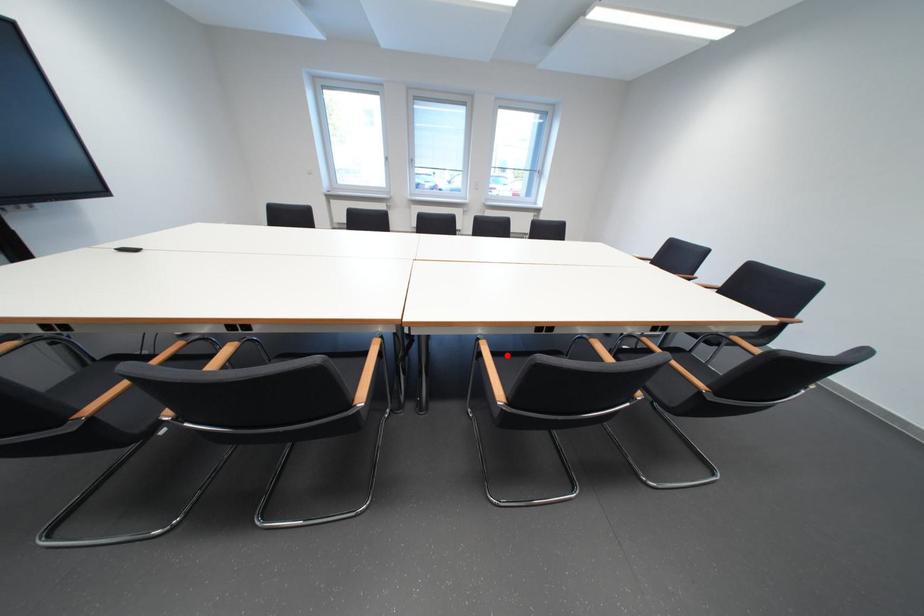
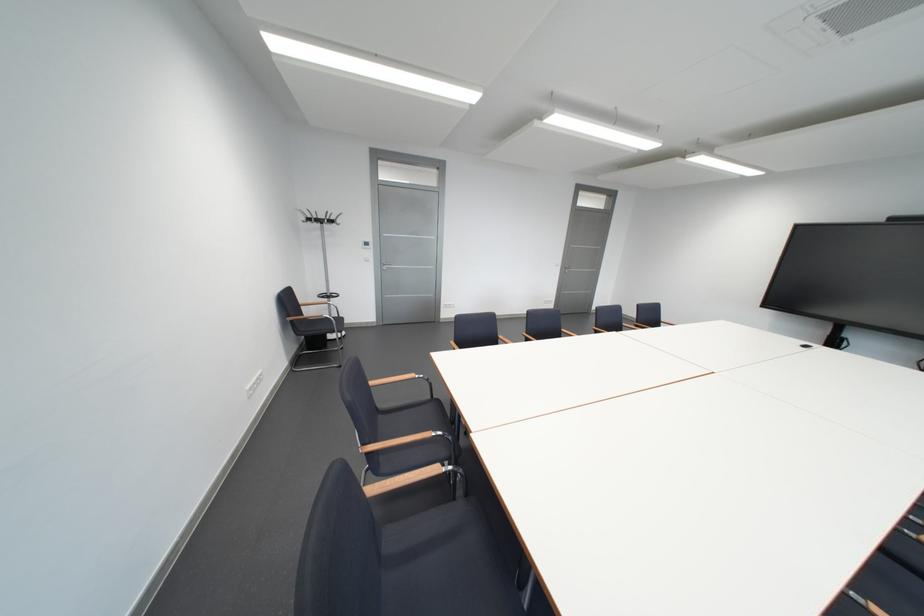
Question: I am providing you with two images of the same scene from different viewpoints. A red point is marked on the first image. Can you still see the location of the red point in image 2?

Choices:
 (A) Yes
 (B) No

Answer: (B)